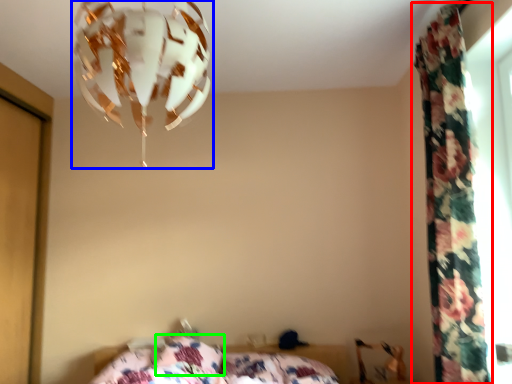
Question: Based on their relative distances, which object is farther from curtain (highlighted by a red box)? Choose from lamp (highlighted by a blue box) and pillow (highlighted by a green box).

Choices:
 (A) lamp
 (B) pillow

Answer: (B)